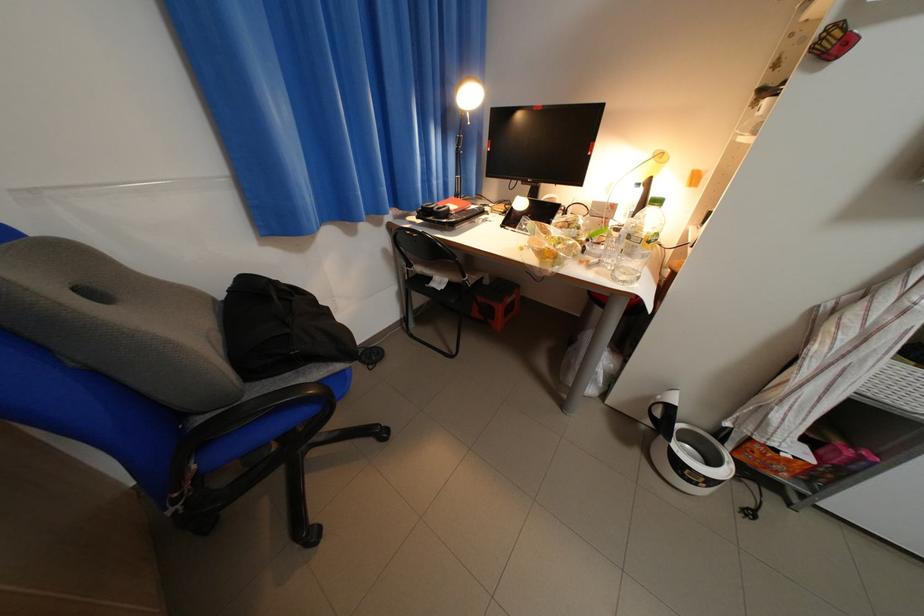
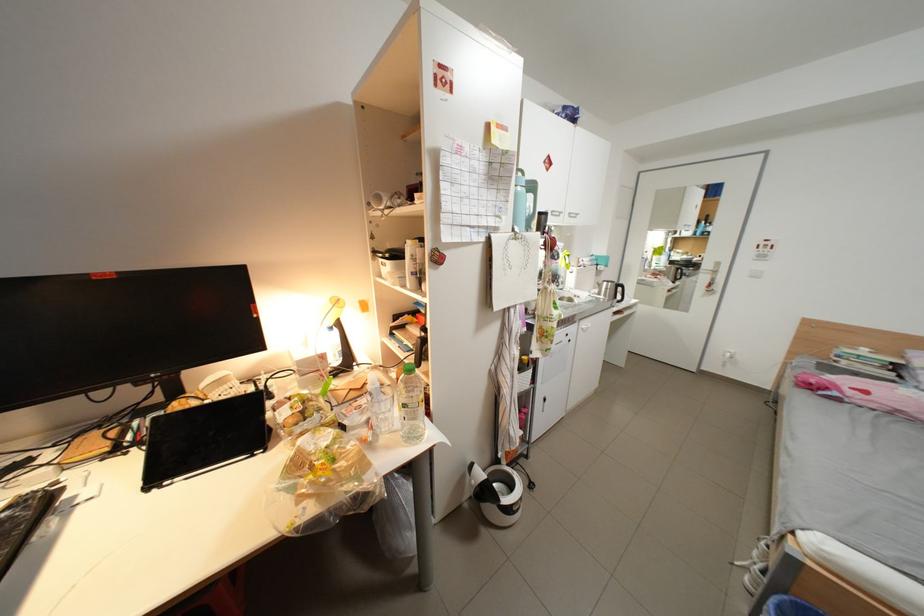
The point at (625,208) is marked in the first image. Where is the corresponding point in the second image?

(334, 358)